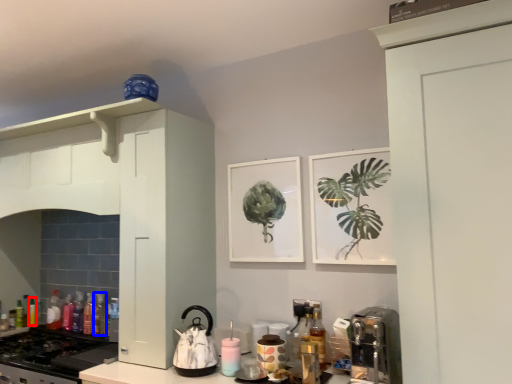
Question: Which of the following is the closest to the observer, bottle (highlighted by a red box) or bottle (highlighted by a blue box)?

Choices:
 (A) bottle
 (B) bottle

Answer: (B)